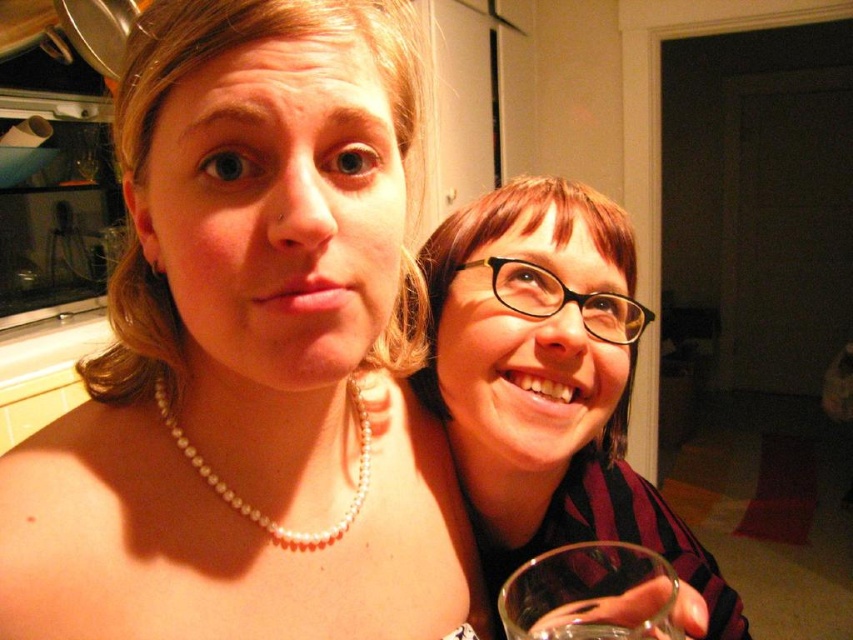
Based on the photo, you are a photographer setting up a shoot in the kitchen. You need to adjust the lighting so that the pearl necklace at upper left and the pearl necklace at center are both clearly visible. Which pearl necklace should you focus on first to ensure it isn not obscured by the other?

The pearl necklace at upper left is in front of the pearl necklace at center, so you should focus on the pearl necklace at center first to ensure it is not obscured by the pearl necklace at upper left.

You are a photographer aiming to capture a clear shot of the pearl necklace at upper left without any obstructions. Given that the transparent glass at lower right is present, can you determine if the necklace will be visible in the photo?

The pearl necklace at upper left is in front of the transparent glass at lower right, so the necklace will be visible in the photo as it is positioned in front of the glass.